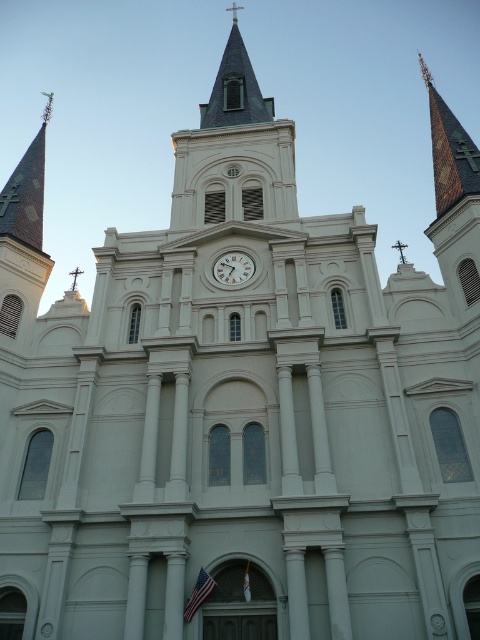
Question: Is dark gray slate spire at upper center to the right of white glossy clock at center from the viewer's perspective?

Choices:
 (A) no
 (B) yes

Answer: (A)

Question: Among these objects, which one is nearest to the camera?

Choices:
 (A) dark gray slate spire at upper center
 (B) golden mosaic spire at upper right

Answer: (B)

Question: Where is dark gray slate spire at upper center located in relation to white glossy clock at center in the image?

Choices:
 (A) left
 (B) right

Answer: (A)

Question: Which of these objects is positioned closest to the dark gray slate spire at upper center?

Choices:
 (A) golden mosaic spire at upper right
 (B) white glossy clock at center

Answer: (A)

Question: Is golden mosaic spire at upper right positioned before dark gray slate spire at upper center?

Choices:
 (A) no
 (B) yes

Answer: (B)

Question: Which of the following is the closest to the observer?

Choices:
 (A) (236, 97)
 (B) (465, 182)
 (C) (239, 284)

Answer: (C)